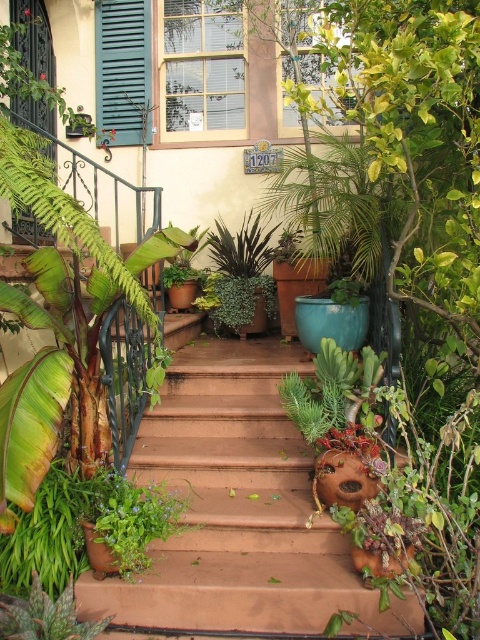
You are a painter standing at the bottom of the brown concrete stairs at center, and you need to paint the green matte shutter at upper left. Considering the height difference between the two, will you need to climb the stairs to reach the shutter?

The brown concrete stairs at center has a lesser height compared to green matte shutter at upper left, so yes, you will need to climb the stairs to reach the green matte shutter at upper left since it is taller.

You are standing in front of the house and want to reach the front door. The brown concrete stairs at center are the only path. Considering your height is 1.7 meters, can you safely walk up the stairs without hitting your head?

The distance between you and the brown concrete stairs at center is 2.29 meters. Since this distance is greater than your height of 1.7 meters, you can safely walk up the stairs without hitting your head.

You are standing at the bottom of the brown concrete stairs at center. If you walk straight ahead, will you reach the blue ceramic pot near the top of the steps?

The brown concrete stairs at center are positioned at point (x=238, y=513), so walking straight ahead from the bottom of the brown concrete stairs at center would lead you towards the blue ceramic pot near the top of the steps.